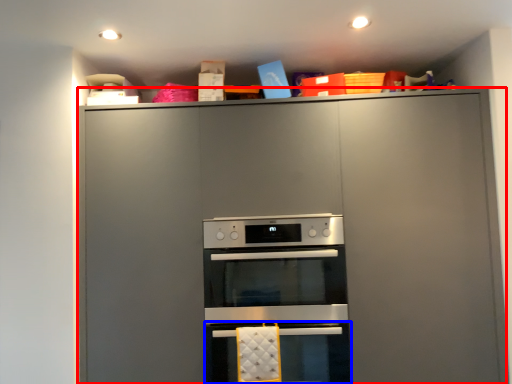
Question: Among these objects, which one is nearest to the camera, cabinetry (highlighted by a red box) or oven (highlighted by a blue box)?

Choices:
 (A) cabinetry
 (B) oven

Answer: (A)